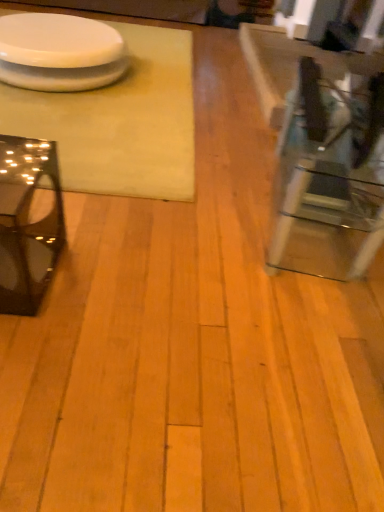
This screenshot has height=512, width=384. In order to click on free space to the right of white glossy platter at upper left in this screenshot , I will do `click(161, 90)`.